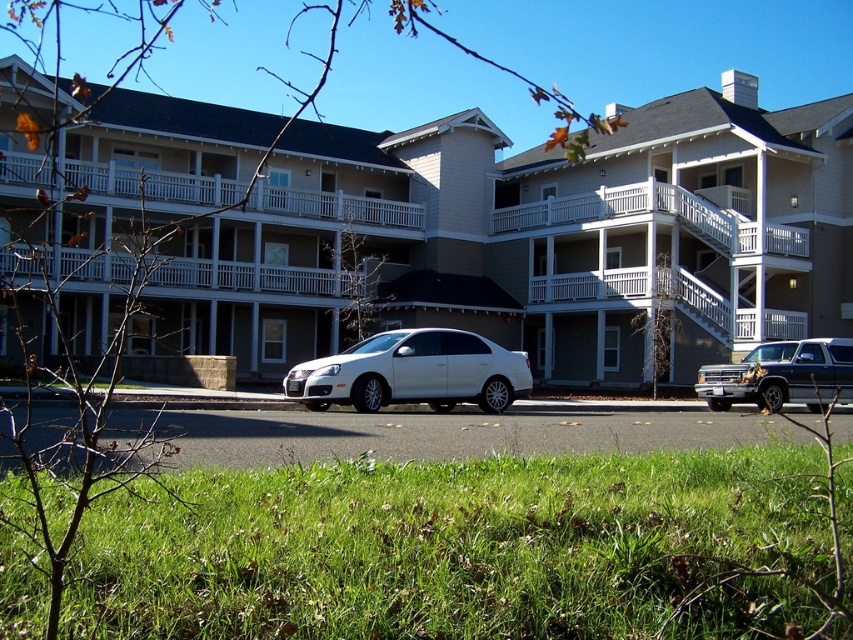
Question: Does green grass at lower center lie in front of white metallic sedan at center?

Choices:
 (A) no
 (B) yes

Answer: (B)

Question: Among these points, which one is nearest to the camera?

Choices:
 (A) (380, 170)
 (B) (358, 374)

Answer: (B)

Question: Does green grass at lower center appear on the left side of white metallic sedan at center?

Choices:
 (A) yes
 (B) no

Answer: (B)

Question: Which object is positioned closest to the white matte building at center?

Choices:
 (A) green grass at lower center
 (B) white metallic sedan at center
 (C) metallic silver truck at right

Answer: (B)

Question: Can you confirm if white metallic sedan at center is positioned to the right of metallic silver truck at right?

Choices:
 (A) yes
 (B) no

Answer: (B)

Question: Which object is closer to the camera taking this photo?

Choices:
 (A) metallic silver truck at right
 (B) white metallic sedan at center
 (C) white matte building at center
 (D) green grass at lower center

Answer: (D)